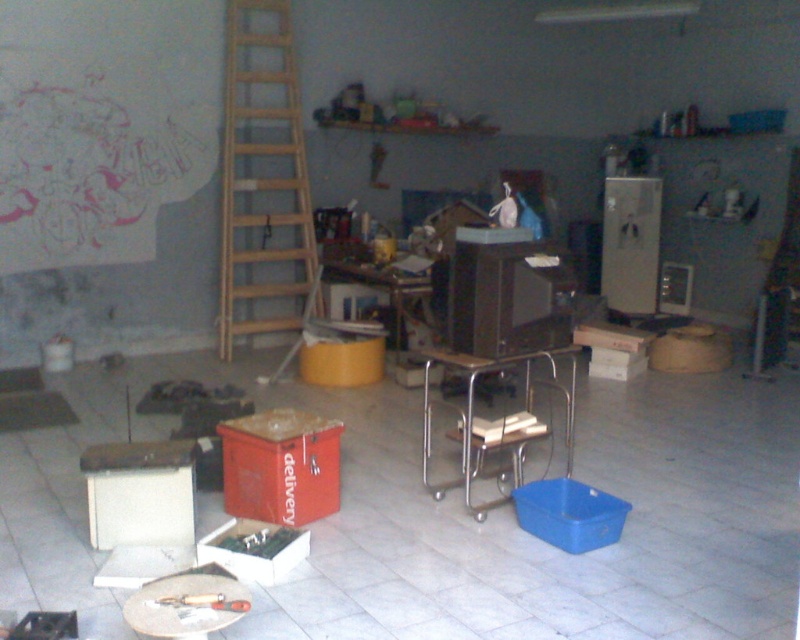
You are standing in the cluttered indoor space and want to reach the ladder leaning against the wall. Which object labeled in the scene is located at the coordinates point (262, 173) that marks the wooden ladder at center left?

The point (262, 173) marks the wooden ladder at center left, so the object at those coordinates is the wooden ladder at center left.